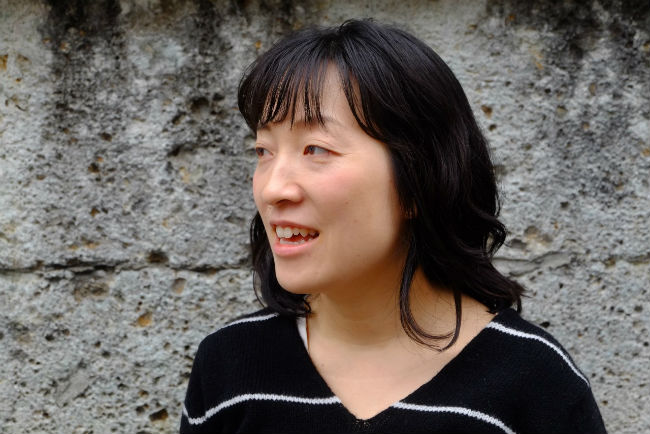
Identify the location of wall. (407, 110), (460, 264), (268, 285).